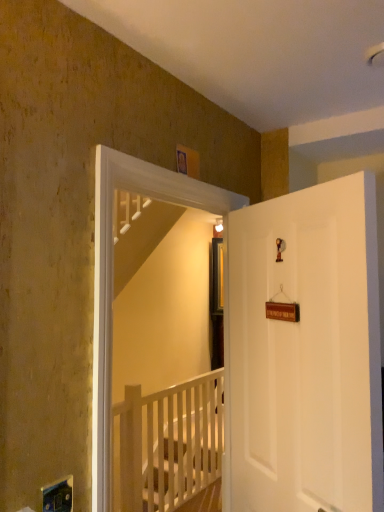
Question: From a real-world perspective, relative to white wooden rail at center, is white wooden screen door at upper center vertically above or below?

Choices:
 (A) above
 (B) below

Answer: (A)

Question: Looking at their shapes, would you say white wooden screen door at upper center is wider or thinner than white wooden rail at center?

Choices:
 (A) thin
 (B) wide

Answer: (A)

Question: Considering the real-world distances, which object is closest to the white wooden rail at center?

Choices:
 (A) white matte door at right
 (B) white wooden screen door at upper center

Answer: (A)

Question: Which object is the farthest from the white matte door at right?

Choices:
 (A) white wooden screen door at upper center
 (B) white wooden rail at center

Answer: (B)